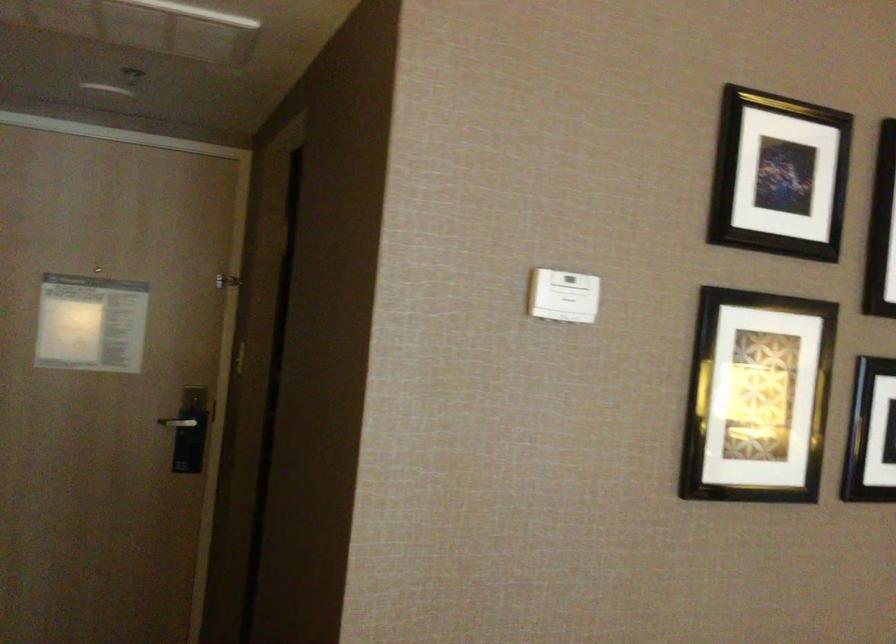
Image resolution: width=896 pixels, height=644 pixels. Describe the element at coordinates (181, 422) in the screenshot. I see `a silver door handle` at that location.